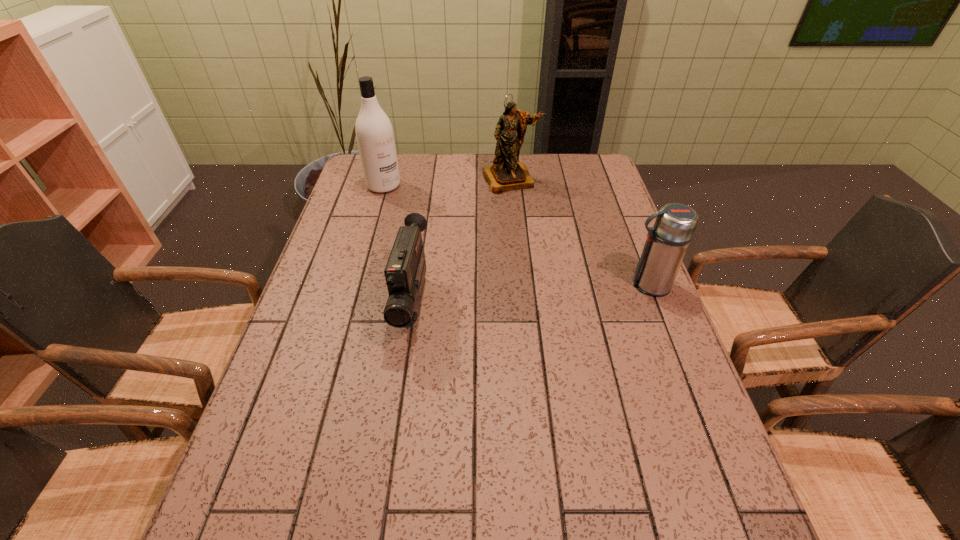
I want to click on free space between the third shortest object and the third object from right to left, so click(462, 242).

This screenshot has height=540, width=960. I want to click on vacant space that's between the shortest object and the second object from right to left, so click(462, 242).

Locate an element on the screen. The width and height of the screenshot is (960, 540). blank region between the thermos bottle and the figurine is located at coordinates (580, 232).

Locate an element on the screen. Image resolution: width=960 pixels, height=540 pixels. blank region between the second tallest object and the thermos bottle is located at coordinates (580, 232).

Where is `free space between the third shortest object and the shortest object`? free space between the third shortest object and the shortest object is located at coordinates (462, 242).

This screenshot has height=540, width=960. I want to click on free point between the second object from right to left and the leftmost object, so click(x=447, y=183).

This screenshot has height=540, width=960. What are the coordinates of `free space between the shortest object and the third shortest object` in the screenshot? It's located at (462, 242).

Point out which object is positioned as the second nearest to the second tallest object. Please provide its 2D coordinates. Your answer should be formatted as a tuple, i.e. [(x, y)], where the tuple contains the x and y coordinates of a point satisfying the conditions above.

[(405, 270)]

Select which object is the second closest to the shortest object. Please provide its 2D coordinates. Your answer should be formatted as a tuple, i.e. [(x, y)], where the tuple contains the x and y coordinates of a point satisfying the conditions above.

[(506, 174)]

You are a GUI agent. You are given a task and a screenshot of the screen. Output one action in this format:
    pyautogui.click(x=<x>, y=<y>)
    Task: Click on the free location that satisfies the following two spatial constraints: 1. on the back side of the figurine; 2. on the right side of the tallest object
    The width and height of the screenshot is (960, 540).
    Given the screenshot: What is the action you would take?
    pyautogui.click(x=385, y=180)